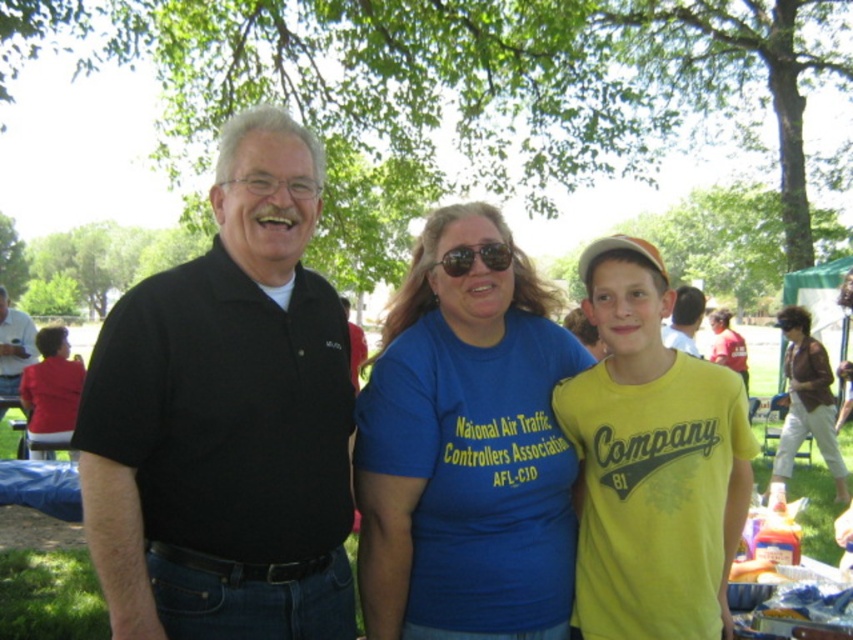
Who is positioned more to the left, brown leather jacket at lower right or matte black shirt at center?

matte black shirt at center

Who is shorter, brown leather jacket at lower right or matte black shirt at center?

matte black shirt at center is shorter.

Is point (807, 346) less distant than point (685, 308)?

That is False.

Locate an element on the screen. brown leather jacket at lower right is located at coordinates (805, 401).

Can you confirm if blue t-shirt at center is positioned to the left of black shirt at center?

In fact, blue t-shirt at center is to the right of black shirt at center.

Consider the image. Does blue t-shirt at center have a greater height compared to black shirt at center?

Correct, blue t-shirt at center is much taller as black shirt at center.

Which is behind, point (524, 444) or point (30, 356)?

The point (30, 356) is behind.

Image resolution: width=853 pixels, height=640 pixels. In order to click on blue t-shirt at center in this screenshot , I will do `click(466, 451)`.

Which is in front, point (372, 445) or point (686, 300)?

Positioned in front is point (372, 445).

Looking at this image, which is below, blue t-shirt at center or matte black shirt at center?

blue t-shirt at center is lower down.

This screenshot has width=853, height=640. What do you see at coordinates (466, 451) in the screenshot?
I see `blue t-shirt at center` at bounding box center [466, 451].

Locate an element on the screen. blue t-shirt at center is located at coordinates (466, 451).